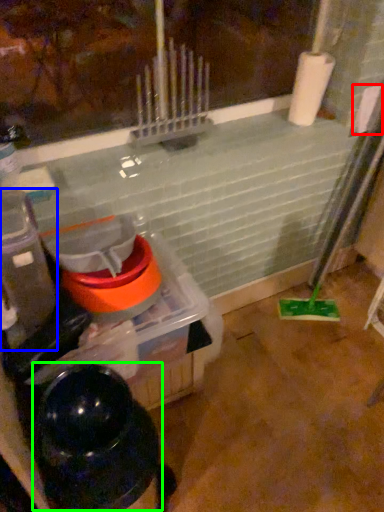
Question: Considering the real-world distances, which object is closest to toilet paper (highlighted by a red box)? appliance (highlighted by a blue box) or water heater (highlighted by a green box).

Choices:
 (A) appliance
 (B) water heater

Answer: (A)